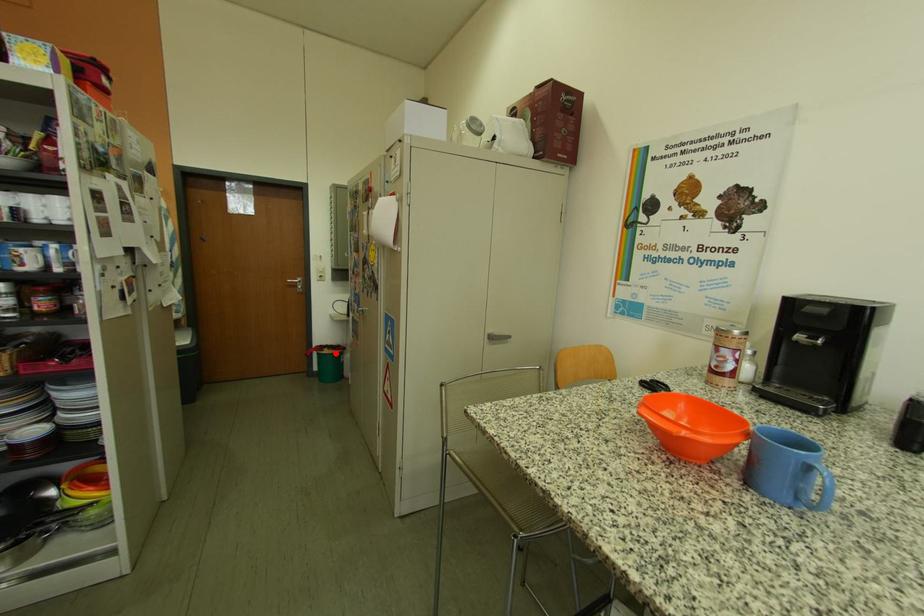
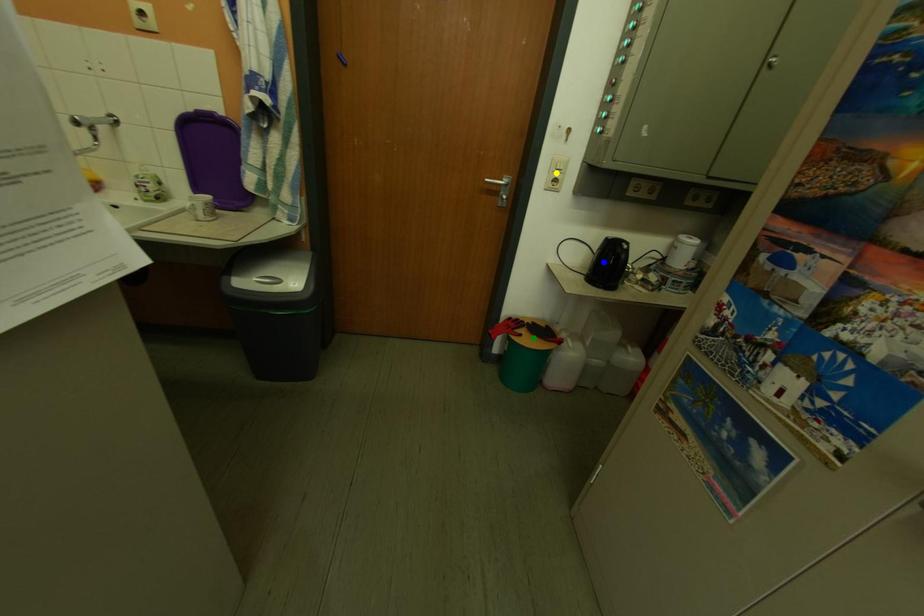
Question: I am providing you with two images of the same scene from different viewpoints. A red point is marked on the first image. You are given multiple points on the second image. Which point in image 2 represents the same 3d spot as the red point in image 1?

Choices:
 (A) yellow point
 (B) blue point
 (C) green point

Answer: (C)